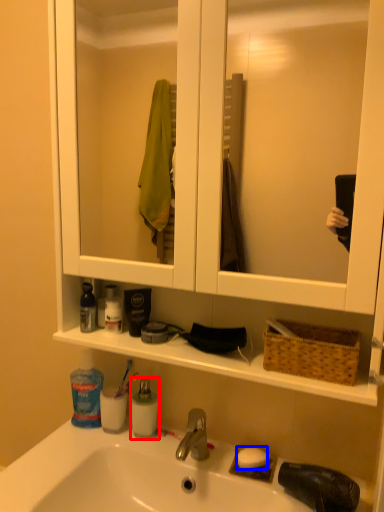
Question: Among these objects, which one is farthest to the camera, mouthwash (highlighted by a red box) or soap (highlighted by a blue box)?

Choices:
 (A) mouthwash
 (B) soap

Answer: (A)